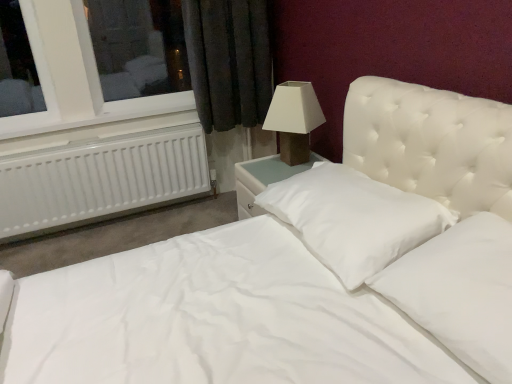
Question: Considering the relative sizes of matte brown lamp at upper right and white plastic radiator at left in the image provided, is matte brown lamp at upper right thinner than white plastic radiator at left?

Choices:
 (A) yes
 (B) no

Answer: (B)

Question: Does matte brown lamp at upper right have a greater width compared to white plastic radiator at left?

Choices:
 (A) no
 (B) yes

Answer: (B)

Question: Can white plastic radiator at left be found inside matte brown lamp at upper right?

Choices:
 (A) no
 (B) yes

Answer: (A)

Question: From the image's perspective, is matte brown lamp at upper right located beneath white plastic radiator at left?

Choices:
 (A) no
 (B) yes

Answer: (B)

Question: Would you say matte brown lamp at upper right is outside white plastic radiator at left?

Choices:
 (A) yes
 (B) no

Answer: (A)

Question: Is white smooth pillow at center, which is the 1th pillow in back-to-front order, wider or thinner than white plastic radiator at left?

Choices:
 (A) wide
 (B) thin

Answer: (A)

Question: Would you say white smooth pillow at center, which is the 1th pillow in back-to-front order, is to the left or to the right of white plastic radiator at left in the picture?

Choices:
 (A) left
 (B) right

Answer: (B)

Question: Looking at the image, does white smooth pillow at center, marked as the second pillow in a front-to-back arrangement, seem bigger or smaller compared to white plastic radiator at left?

Choices:
 (A) small
 (B) big

Answer: (A)

Question: Is point (392, 218) closer or farther from the camera than point (88, 152)?

Choices:
 (A) closer
 (B) farther

Answer: (A)

Question: Would you say matte brown lamp at upper right is to the left or to the right of white plastic radiator at left in the picture?

Choices:
 (A) left
 (B) right

Answer: (B)

Question: Based on their sizes in the image, would you say matte brown lamp at upper right is bigger or smaller than white plastic radiator at left?

Choices:
 (A) big
 (B) small

Answer: (B)

Question: Considering their positions, is matte brown lamp at upper right located in front of or behind white plastic radiator at left?

Choices:
 (A) behind
 (B) front

Answer: (B)

Question: Is matte brown lamp at upper right inside the boundaries of white plastic radiator at left, or outside?

Choices:
 (A) inside
 (B) outside

Answer: (B)

Question: Considering the positions of point (507, 230) and point (281, 130), is point (507, 230) closer or farther from the camera than point (281, 130)?

Choices:
 (A) farther
 (B) closer

Answer: (B)

Question: Is white soft pillow at center, positioned as the 1th pillow in front-to-back order, taller or shorter than matte brown lamp at upper right?

Choices:
 (A) short
 (B) tall

Answer: (A)